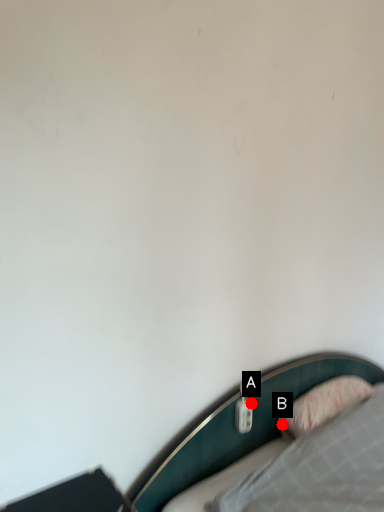
Question: Two points are circled on the image, labeled by A and B beside each circle. Among these points, which one is farthest from the camera?

Choices:
 (A) A is further
 (B) B is further

Answer: (B)